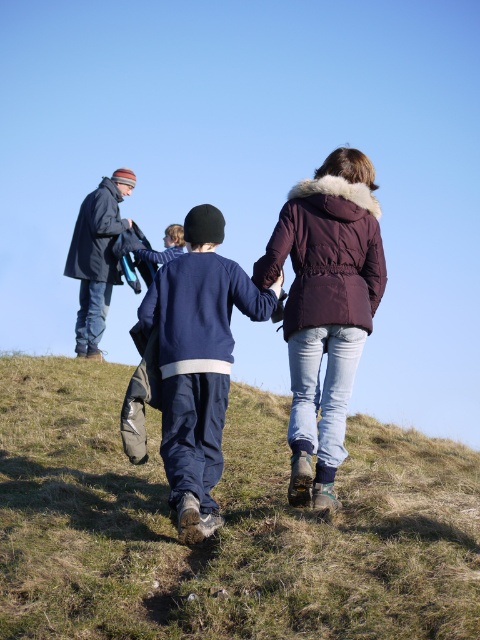
You are planning to set up a picnic on the green grassy at lower center. Considering the size of the navy blue fleece at center, will there be enough space for the picnic blanket?

The green grassy at lower center is smaller than the navy blue fleece at center, so the picnic blanket may not fit comfortably if the fleece takes up more space.

You are standing on the grassy hill and see two points marked on the ground. The first point is at coordinate point (x=381, y=282) and the second point is at coordinate point (x=196, y=474). Which point is closer to you?

Point (x=381, y=282) is closer to you because it is further to the viewer than point (x=196, y=474).